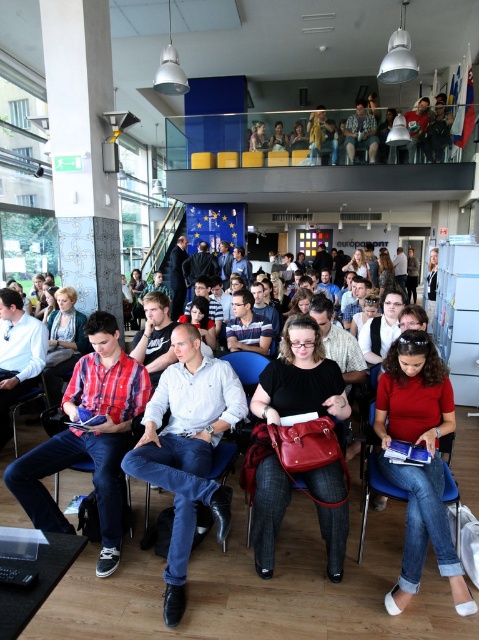
Based on the photo, is white cotton shirt at center shorter than matte red blouse at lower right?

No, white cotton shirt at center is not shorter than matte red blouse at lower right.

How distant is white cotton shirt at center from matte red blouse at lower right?

white cotton shirt at center is 37.96 inches from matte red blouse at lower right.

Between point (148, 440) and point (419, 394), which one is positioned in front?

Point (148, 440)

The width and height of the screenshot is (479, 640). I want to click on white cotton shirt at center, so click(186, 449).

How far apart are matte black bag at center and matte red blouse at lower right?

The distance of matte black bag at center from matte red blouse at lower right is 43.56 centimeters.

Measure the distance between point (314, 456) and camera.

Point (314, 456) is 7.80 feet from camera.

Is point (281, 362) closer to camera compared to point (472, 605)?

No, it is not.

Locate an element on the screen. Image resolution: width=479 pixels, height=640 pixels. matte black bag at center is located at coordinates (297, 444).

Who is higher up, matte red blouse at lower right or matte black jacket at upper center?

matte black jacket at upper center

Can you confirm if matte red blouse at lower right is shorter than matte black jacket at upper center?

Correct, matte red blouse at lower right is not as tall as matte black jacket at upper center.

Locate an element on the screen. matte red blouse at lower right is located at coordinates (419, 467).